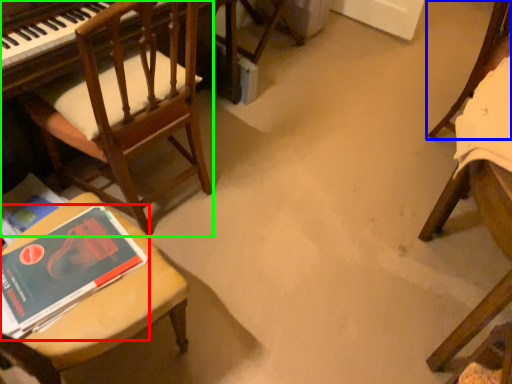
Question: Which is nearer to the book (highlighted by a red box)? chair (highlighted by a blue box) or chair (highlighted by a green box).

Choices:
 (A) chair
 (B) chair

Answer: (B)